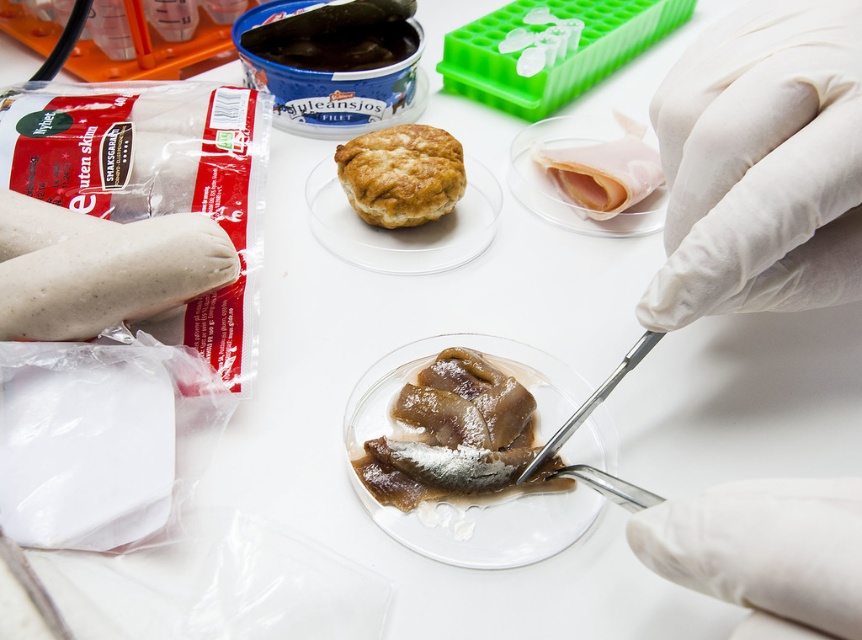
You are a food inspector in the lab. You need to check if the white smooth glove at upper right is positioned above the translucent gelatinous fish at center. Based on your observation, is this true?

Yes, the white smooth glove at upper right is above the translucent gelatinous fish at center according to the description.

You are a food inspector who needs to reach the white latex glove at upper right to handle a sample. Considering your arm length is 24 inches, can you comfortably reach it without moving your position?

The white latex glove at upper right is 6.18 inches away from the viewer. Since your arm length is 24 inches, which is longer than the distance, you can comfortably reach it without moving your position.